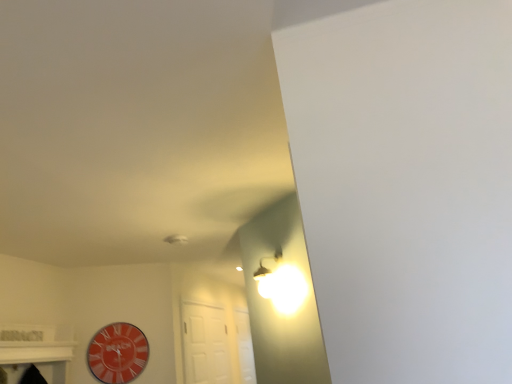
Question: Is orange glossy clock at lower left not inside white matte door at center?

Choices:
 (A) no
 (B) yes

Answer: (B)

Question: From the image's perspective, is orange glossy clock at lower left located beneath white matte door at center?

Choices:
 (A) no
 (B) yes

Answer: (A)

Question: Is orange glossy clock at lower left positioned with its back to white matte door at center?

Choices:
 (A) yes
 (B) no

Answer: (B)

Question: From the image's perspective, is orange glossy clock at lower left on top of white matte door at center?

Choices:
 (A) yes
 (B) no

Answer: (A)

Question: Is orange glossy clock at lower left to the left of white matte door at center from the viewer's perspective?

Choices:
 (A) yes
 (B) no

Answer: (A)

Question: Does orange glossy clock at lower left have a larger size compared to white matte door at center?

Choices:
 (A) yes
 (B) no

Answer: (B)

Question: Is white matte door at center thinner than orange glossy clock at lower left?

Choices:
 (A) yes
 (B) no

Answer: (B)

Question: Is orange glossy clock at lower left inside white matte door at center?

Choices:
 (A) no
 (B) yes

Answer: (A)

Question: Considering the relative sizes of white matte door at center and orange glossy clock at lower left in the image provided, is white matte door at center smaller than orange glossy clock at lower left?

Choices:
 (A) yes
 (B) no

Answer: (B)

Question: Does white matte door at center come behind orange glossy clock at lower left?

Choices:
 (A) no
 (B) yes

Answer: (B)

Question: Could you tell me if white matte door at center is turned towards orange glossy clock at lower left?

Choices:
 (A) no
 (B) yes

Answer: (A)

Question: Is white matte door at center in front of orange glossy clock at lower left?

Choices:
 (A) no
 (B) yes

Answer: (A)

Question: Considering the positions of orange glossy clock at lower left and white matte door at center in the image, is orange glossy clock at lower left bigger or smaller than white matte door at center?

Choices:
 (A) small
 (B) big

Answer: (A)